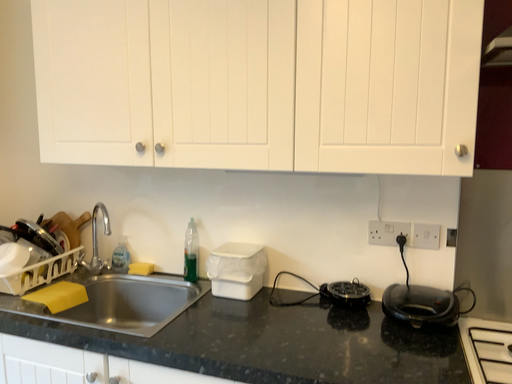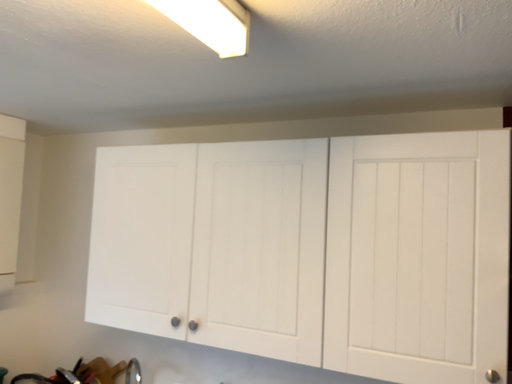
Question: How did the camera likely rotate when shooting the video?

Choices:
 (A) rotated downward
 (B) rotated upward

Answer: (B)